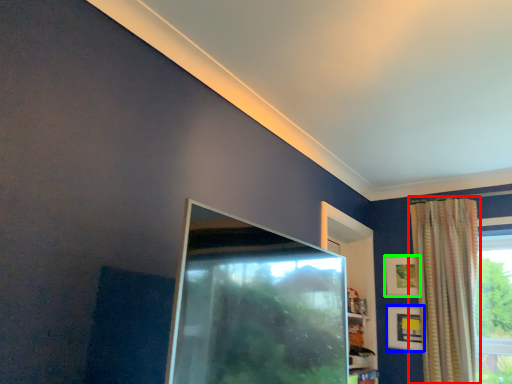
Question: Considering the real-world distances, which object is farthest from curtain (highlighted by a red box)? picture frame (highlighted by a blue box) or picture frame (highlighted by a green box)?

Choices:
 (A) picture frame
 (B) picture frame

Answer: (A)